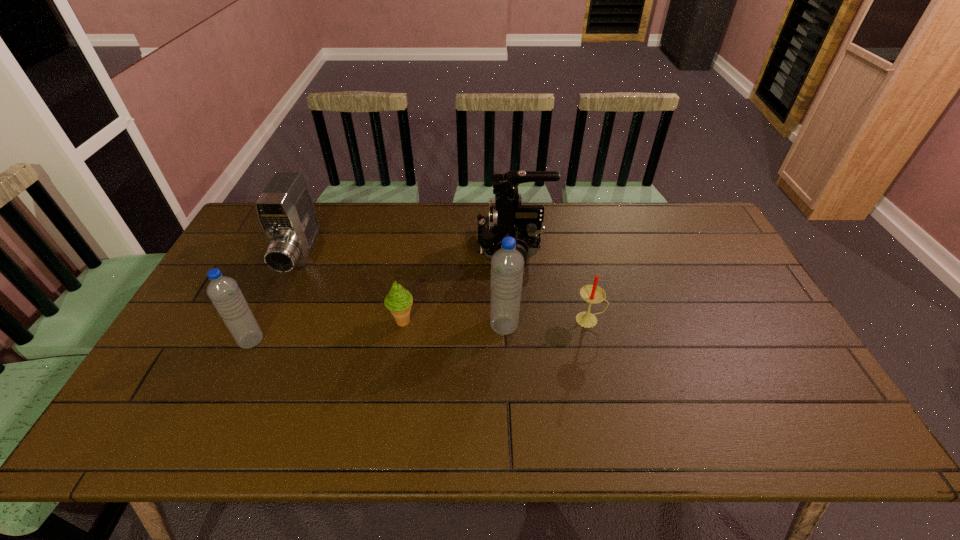
Image resolution: width=960 pixels, height=540 pixels. I want to click on free spot located 0.110m on the lens mount of the taller camcorder, so click(x=443, y=248).

Identify the location of blank space located at the front of the shorter camcorder, highlighting the lens. (246, 376).

Image resolution: width=960 pixels, height=540 pixels. Find the location of `vacant area situated on the back of the candle`. vacant area situated on the back of the candle is located at coordinates (573, 251).

This screenshot has width=960, height=540. Identify the location of vacant space positioned 0.160m on the back of the fourth object from right to left. (410, 272).

Find the location of a particular element. The width and height of the screenshot is (960, 540). vacant region at the far edge is located at coordinates (398, 214).

Image resolution: width=960 pixels, height=540 pixels. In order to click on blank space at the near edge in this screenshot , I will do pos(420,392).

Where is `vacant space at the left edge of the desktop`? This screenshot has height=540, width=960. vacant space at the left edge of the desktop is located at coordinates (261, 284).

Find the location of `vacant region at the right edge of the desktop`. vacant region at the right edge of the desktop is located at coordinates (730, 258).

In order to click on vacant space at the near right corner of the desktop in this screenshot , I will do `click(758, 389)`.

This screenshot has width=960, height=540. Find the location of `free space between the right water bottle and the shorter water bottle`. free space between the right water bottle and the shorter water bottle is located at coordinates pyautogui.click(x=377, y=333).